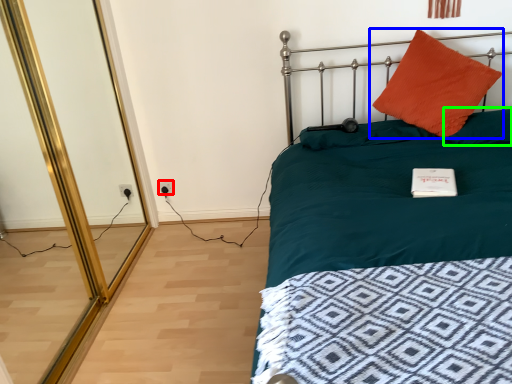
Question: Which object is the farthest from electric outlet (highlighted by a red box)? Choose among these: pillow (highlighted by a blue box) or pillow (highlighted by a green box).

Choices:
 (A) pillow
 (B) pillow

Answer: (B)